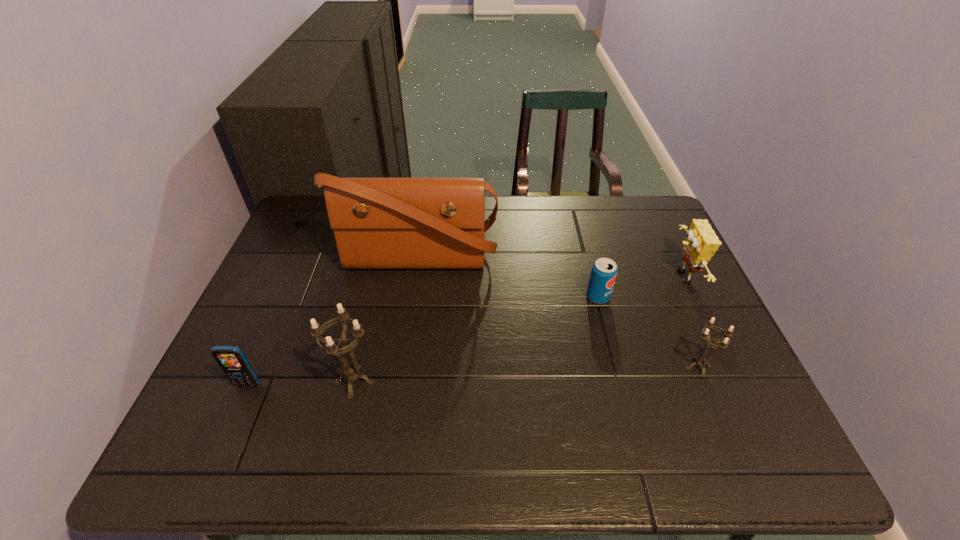
This screenshot has width=960, height=540. Identify the location of free space located on the front flap of the tallest object. (396, 401).

At what (x,y) coordinates should I click in order to perform the action: click on vacant position located on the back of the fourth object from left to right. Please return your answer as a coordinate pair (x, y). Image resolution: width=960 pixels, height=540 pixels. Looking at the image, I should click on (587, 253).

Identify the location of free space located on the face of the fourth shortest object. (644, 276).

The image size is (960, 540). I want to click on vacant space situated on the face of the fourth shortest object, so click(584, 276).

What are the coordinates of `vacant space located 0.290m on the face of the fourth shortest object` in the screenshot? It's located at (566, 276).

Image resolution: width=960 pixels, height=540 pixels. In order to click on object that is at the far edge in this screenshot , I will do `click(379, 223)`.

Identify the location of candle holder located in the near edge section of the desktop. This screenshot has width=960, height=540. (351, 374).

The width and height of the screenshot is (960, 540). I want to click on cellular telephone present at the near edge, so click(231, 359).

This screenshot has width=960, height=540. What are the coordinates of `object at the left edge` in the screenshot? It's located at (231, 359).

At what (x,y) coordinates should I click in order to perform the action: click on candle holder that is at the right edge. Please return your answer as a coordinate pair (x, y). Looking at the image, I should click on (702, 362).